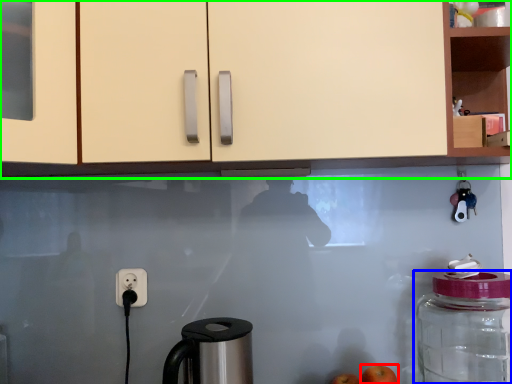
Question: Considering the real-world distances, which object is farthest from apple (highlighted by a red box)? bottle (highlighted by a blue box) or cabinetry (highlighted by a green box)?

Choices:
 (A) bottle
 (B) cabinetry

Answer: (B)